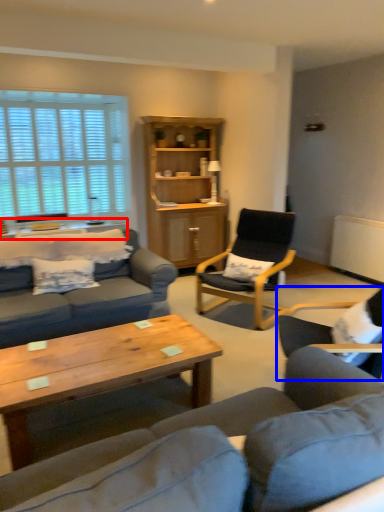
Question: Which point is further to the camera, table (highlighted by a red box) or chair (highlighted by a blue box)?

Choices:
 (A) table
 (B) chair

Answer: (A)